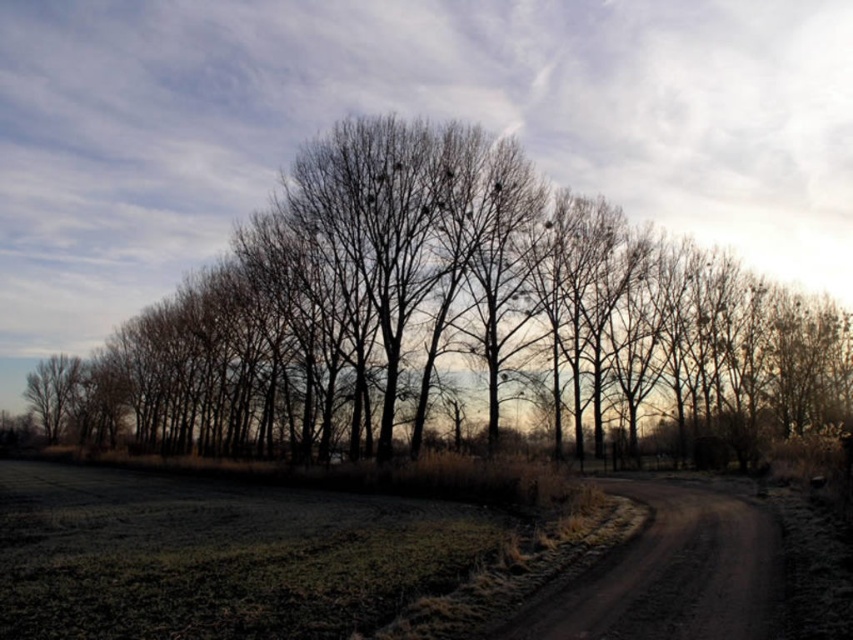
Measure the distance between brown bark tree at center and dusty brown dirt track at lower right.

The distance of brown bark tree at center from dusty brown dirt track at lower right is 113.20 meters.

You are a GUI agent. You are given a task and a screenshot of the screen. Output one action in this format:
    pyautogui.click(x=<x>, y=<y>)
    Task: Click on the brown bark tree at center
    The height and width of the screenshot is (640, 853).
    Given the screenshot: What is the action you would take?
    pyautogui.click(x=444, y=317)